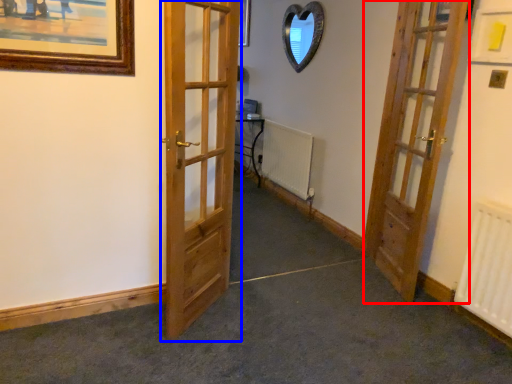
Question: Which of the following is the farthest to the observer, door (highlighted by a red box) or door (highlighted by a blue box)?

Choices:
 (A) door
 (B) door

Answer: (A)